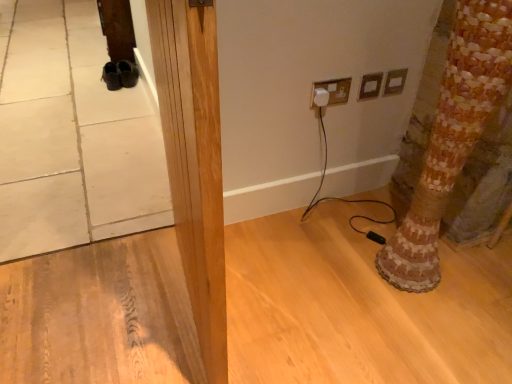
This screenshot has width=512, height=384. In order to click on free point in front of natural wood pillar at center in this screenshot , I will do `click(176, 350)`.